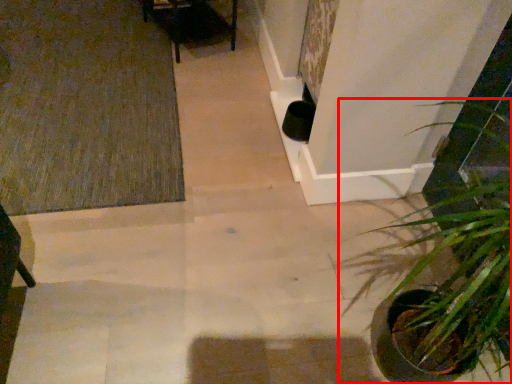
Question: From the image's perspective, where is houseplant (annotated by the red box) located in relation to doormat in the image?

Choices:
 (A) below
 (B) above

Answer: (A)